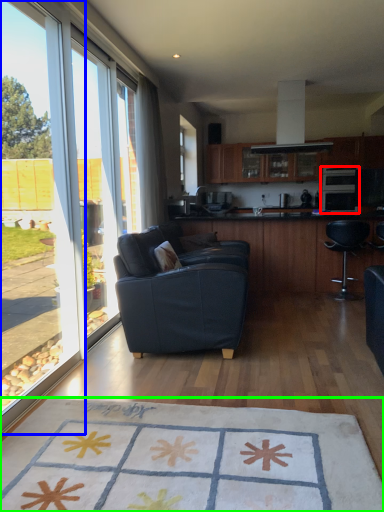
Question: Which object is the closest to the appliance (highlighted by a red box)? Choose among these: window (highlighted by a blue box) or mat (highlighted by a green box).

Choices:
 (A) window
 (B) mat

Answer: (A)